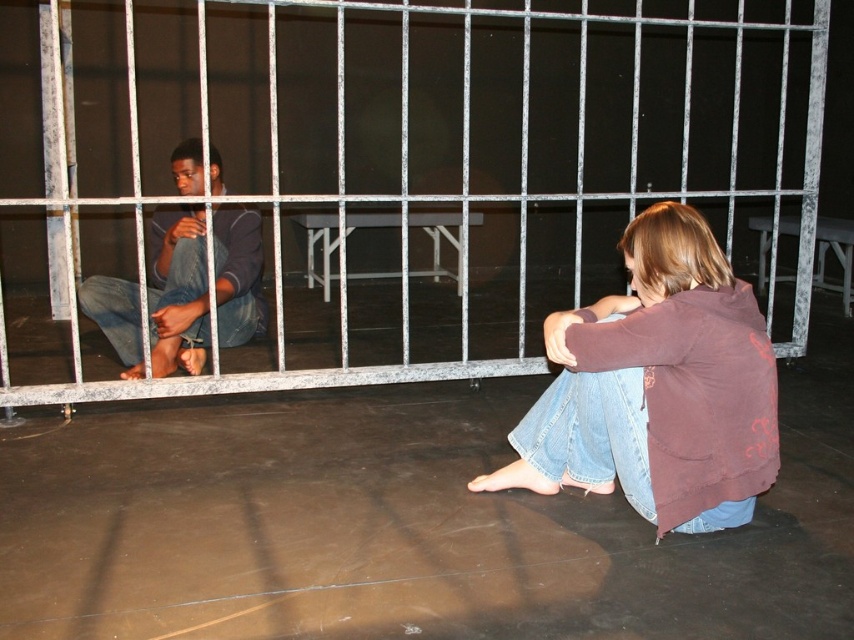
Is metallic silver cage at center wider than brown cotton hoodie at lower right?

No.

Who is positioned more to the right, metallic silver cage at center or brown cotton hoodie at lower right?

metallic silver cage at center

Describe the element at coordinates (410, 148) in the screenshot. I see `metallic silver cage at center` at that location.

You are a GUI agent. You are given a task and a screenshot of the screen. Output one action in this format:
    pyautogui.click(x=<x>, y=<y>)
    Task: Click on the metallic silver cage at center
    This screenshot has height=640, width=854.
    Given the screenshot: What is the action you would take?
    pyautogui.click(x=410, y=148)

Does metallic silver cage at center have a larger size compared to dark blue jeans at left?

No.

Is metallic silver cage at center in front of dark blue jeans at left?

No.

Measure the distance between metallic silver cage at center and camera.

A distance of 6.30 meters exists between metallic silver cage at center and camera.

Where is `metallic silver cage at center`? Image resolution: width=854 pixels, height=640 pixels. metallic silver cage at center is located at coordinates (410, 148).

Is brown cotton hoodie at lower right taller than dark blue jeans at left?

No, brown cotton hoodie at lower right is not taller than dark blue jeans at left.

Can you confirm if brown cotton hoodie at lower right is shorter than dark blue jeans at left?

Yes, brown cotton hoodie at lower right is shorter than dark blue jeans at left.

Find the location of `brown cotton hoodie at lower right`. brown cotton hoodie at lower right is located at coordinates (658, 387).